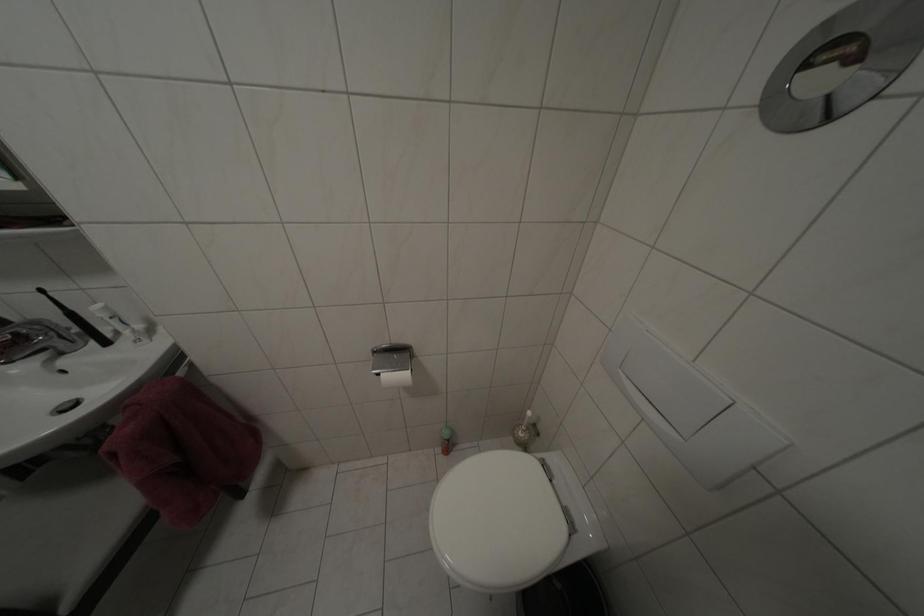
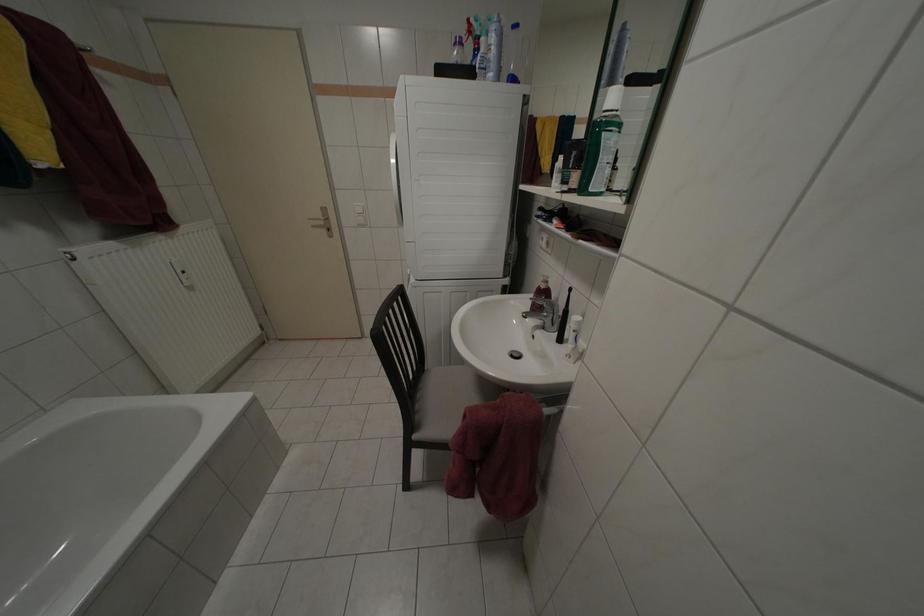
Based on the continuous images, in which direction is the camera rotating?

The camera's rotation is toward left-down.